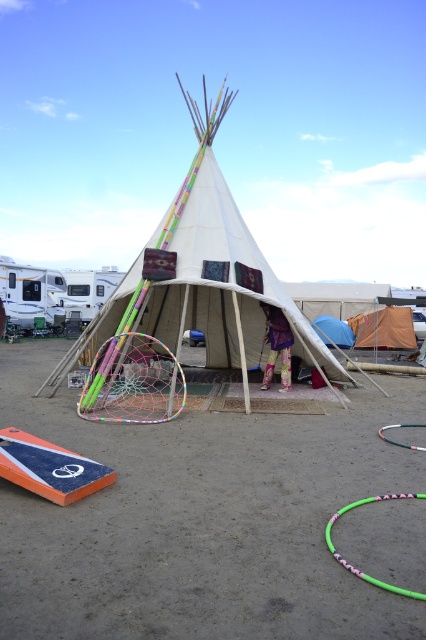
Does dirt field at center appear under multicolored netting hula hoop at center?

Indeed, dirt field at center is positioned under multicolored netting hula hoop at center.

How far apart are dirt field at center and multicolored netting hula hoop at center?

They are 4.57 meters apart.

Who is more distant from viewer, (x=34, y=374) or (x=141, y=349)?

The point (x=141, y=349) is behind.

Where is `dirt field at center`? Image resolution: width=426 pixels, height=640 pixels. dirt field at center is located at coordinates (201, 520).

Measure the distance between dirt field at center and camera.

They are 4.27 meters apart.

Does dirt field at center come behind white canvas teepee at center?

That is False.

Which is behind, point (9, 401) or point (183, 268)?

Point (183, 268)

The image size is (426, 640). I want to click on dirt field at center, so click(x=201, y=520).

You are a GUI agent. You are given a task and a screenshot of the screen. Output one action in this format:
    pyautogui.click(x=<x>, y=<y>)
    Task: Click on the white canvas teepee at center
    This screenshot has width=426, height=640.
    Given the screenshot: What is the action you would take?
    pyautogui.click(x=201, y=292)

Is point (230, 246) in front of point (345, 324)?

That is True.

The height and width of the screenshot is (640, 426). I want to click on white canvas teepee at center, so click(201, 292).